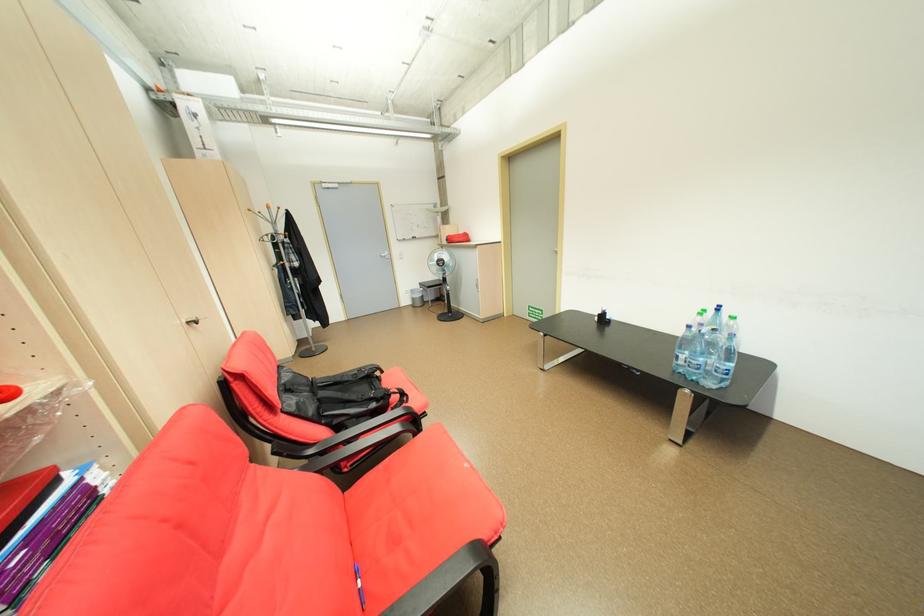
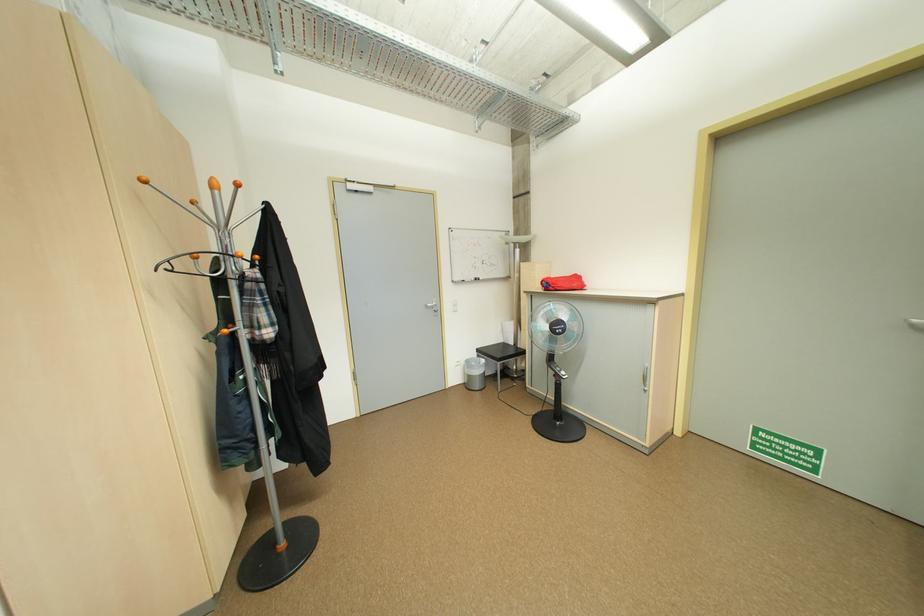
Where in the second image is the point corresponding to the point at 455,243 from the first image?

(550, 290)